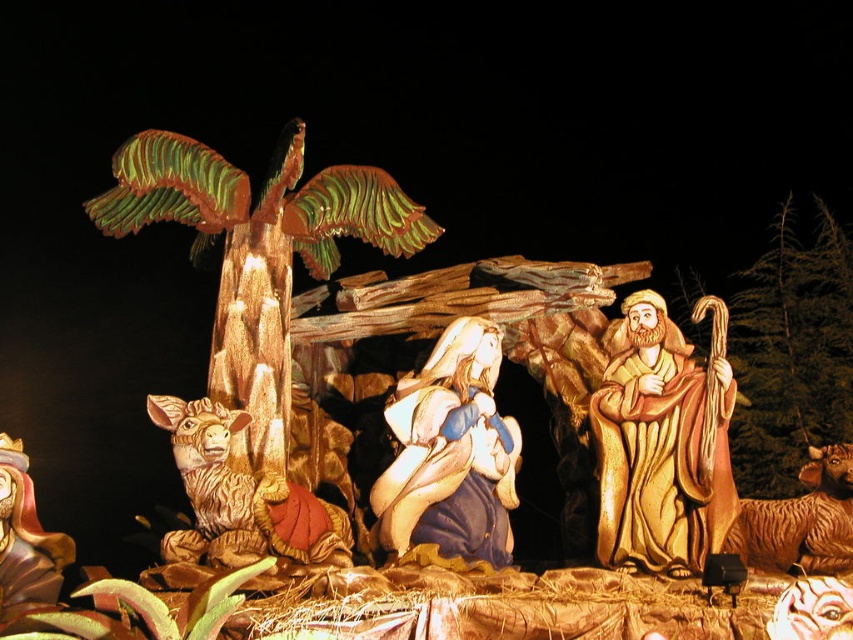
Can you confirm if golden carved shepherd at right is positioned below brown textured sheep at lower right?

Actually, golden carved shepherd at right is above brown textured sheep at lower right.

Is golden carved shepherd at right to the right of brown textured sheep at lower right from the viewer's perspective?

No, golden carved shepherd at right is not to the right of brown textured sheep at lower right.

Who is more forward, (x=723, y=412) or (x=798, y=502)?

Point (x=798, y=502)

Where is `golden carved shepherd at right`? This screenshot has height=640, width=853. golden carved shepherd at right is located at coordinates (662, 442).

Does wooden palm tree at left have a larger size compared to golden carved shepherd at right?

Indeed, wooden palm tree at left has a larger size compared to golden carved shepherd at right.

Can you confirm if wooden palm tree at left is positioned to the left of golden carved shepherd at right?

Yes, wooden palm tree at left is to the left of golden carved shepherd at right.

The height and width of the screenshot is (640, 853). Find the location of `wooden palm tree at left`. wooden palm tree at left is located at coordinates (259, 314).

Which is more to the right, wooden palm tree at left or matte blue fabric at center?

From the viewer's perspective, matte blue fabric at center appears more on the right side.

Who is taller, wooden palm tree at left or matte blue fabric at center?

wooden palm tree at left

Is point (296, 140) positioned before point (474, 403)?

No, (296, 140) is behind (474, 403).

This screenshot has width=853, height=640. What are the coordinates of `wooden palm tree at left` in the screenshot? It's located at (259, 314).